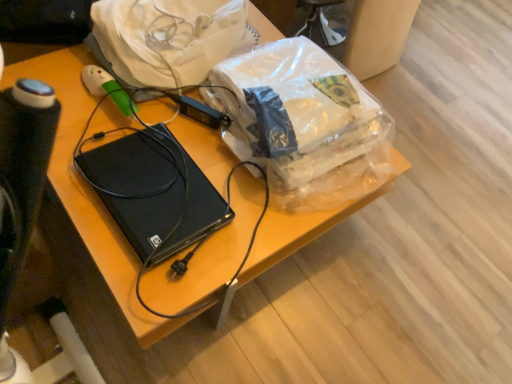
Locate an element on the screen. vacant space that's between translucent plastic bag at center and white plastic bag at upper center is located at coordinates click(216, 139).